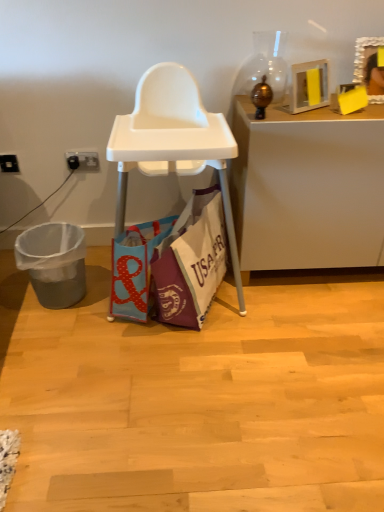
At what (x,y) coordinates should I click in order to perform the action: click on free spot to the right of purple fabric bag at center, which is counted as the 1th handbag, starting from the right. Please return your answer as a coordinate pair (x, y). Looking at the image, I should click on (291, 307).